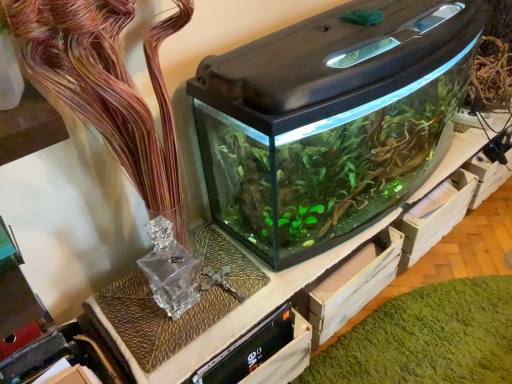
Question: Considering the positions of transparent glass aquarium at center and translucent glass vase at upper center in the image, is transparent glass aquarium at center bigger or smaller than translucent glass vase at upper center?

Choices:
 (A) big
 (B) small

Answer: (A)

Question: From the image's perspective, relative to translucent glass vase at upper center, is transparent glass aquarium at center above or below?

Choices:
 (A) above
 (B) below

Answer: (A)

Question: Which is nearer to the transparent glass aquarium at center?

Choices:
 (A) translucent glass vase at upper center
 (B) green matte algae at center

Answer: (A)

Question: Estimate the real-world distances between objects in this image. Which object is closer to the green matte algae at center?

Choices:
 (A) translucent glass vase at upper center
 (B) transparent glass aquarium at center

Answer: (B)